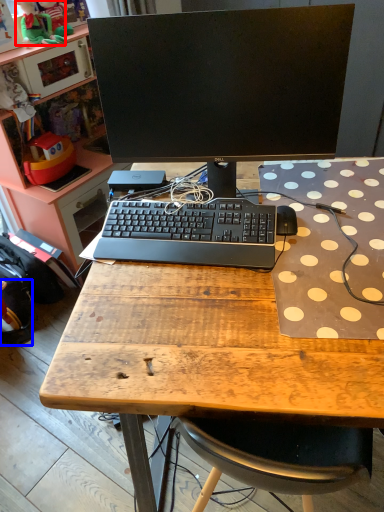
Question: Which point is further to the camera, toy (highlighted by a red box) or backpack (highlighted by a blue box)?

Choices:
 (A) toy
 (B) backpack

Answer: (A)